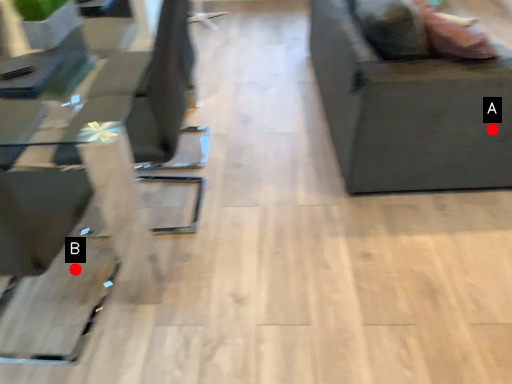
Question: Two points are circled on the image, labeled by A and B beside each circle. Which point appears closest to the camera in this image?

Choices:
 (A) A is closer
 (B) B is closer

Answer: (B)